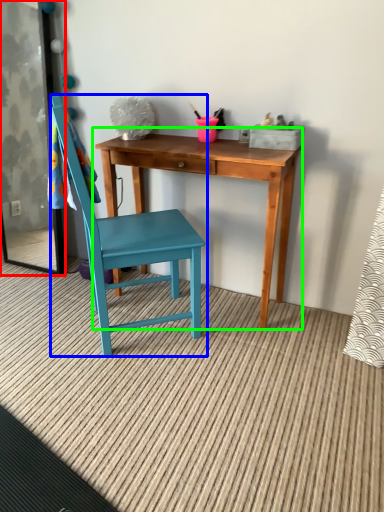
Question: Which object is the farthest from screen door (highlighted by a red box)? Choose among these: chair (highlighted by a blue box) or table (highlighted by a green box).

Choices:
 (A) chair
 (B) table

Answer: (B)